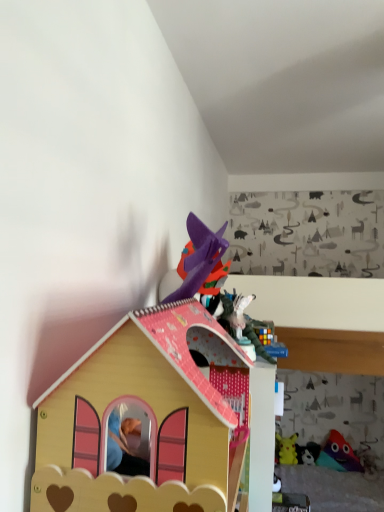
Question: Looking at their shapes, would you say multicolored plush toy at lower right, marked as the second toy in a top-to-bottom arrangement, is wider or thinner than yellow plush toy at upper right, marked as the 4th toy in a right-to-left arrangement?

Choices:
 (A) wide
 (B) thin

Answer: (B)

Question: From the image's perspective, relative to yellow plush toy at upper right, placed as the 3th toy when sorted from top to bottom, is multicolored plush toy at lower right, marked as the second toy in a top-to-bottom arrangement, above or below?

Choices:
 (A) below
 (B) above

Answer: (B)

Question: Which object is the closest to the wooden dollhouse at center, the fifth toy in the back-to-front sequence?

Choices:
 (A) white matte plush toy at lower right, acting as the 4th toy starting from the front
 (B) yellow plush toy at upper right, placed as the 3th toy when sorted from top to bottom
 (C) multicolored plush toy at lower right, the 3th toy viewed from the front
 (D) rubber duck at lower right, which appears as the 2th toy when viewed from the front

Answer: (B)

Question: Which object is positioned farthest from the white matte plush toy at lower right, acting as the 4th toy starting from the front?

Choices:
 (A) rubber duck at lower right, marked as the 5th toy in a top-to-bottom arrangement
 (B) wooden dollhouse at center, arranged as the 5th toy when viewed from the right
 (C) multicolored plush toy at lower right, acting as the second toy starting from the right
 (D) yellow plush toy at upper right, marked as the 4th toy in a right-to-left arrangement

Answer: (B)